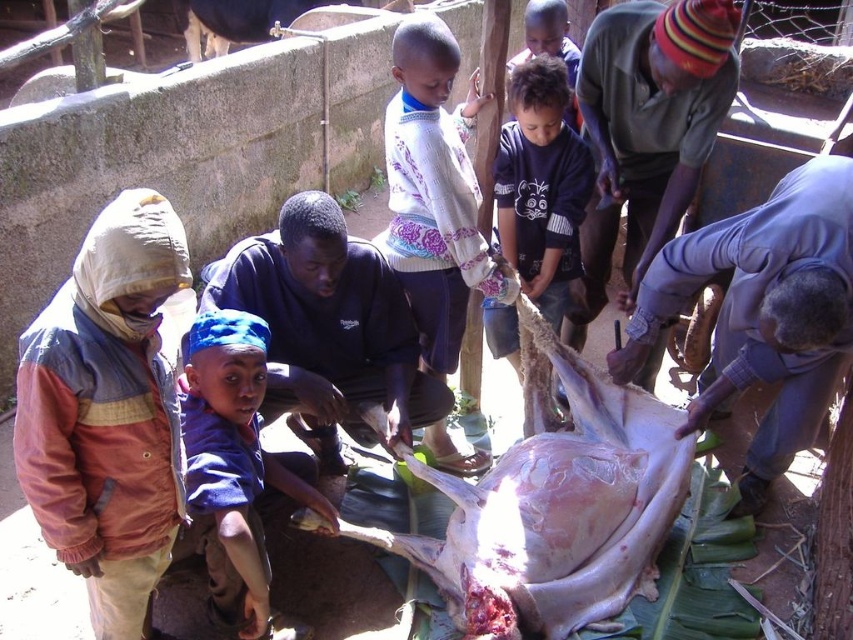
Question: Can you confirm if raw flesh at center is positioned to the right of dark blue cotton shirt at center?

Choices:
 (A) no
 (B) yes

Answer: (A)

Question: Based on their relative distances, which object is farther from the blue fabric headband at lower left?

Choices:
 (A) raw flesh at center
 (B) dark blue cotton shirt at center

Answer: (B)

Question: Which point appears closest to the camera in this image?

Choices:
 (A) (567, 264)
 (B) (630, 512)
 (C) (256, 627)

Answer: (C)

Question: Which object is closer to the camera taking this photo?

Choices:
 (A) raw flesh at center
 (B) blue fabric headband at lower left

Answer: (B)

Question: Is raw flesh at center to the left of blue fabric headband at lower left from the viewer's perspective?

Choices:
 (A) no
 (B) yes

Answer: (A)

Question: Is raw flesh at center further to camera compared to blue fabric headband at lower left?

Choices:
 (A) yes
 (B) no

Answer: (A)